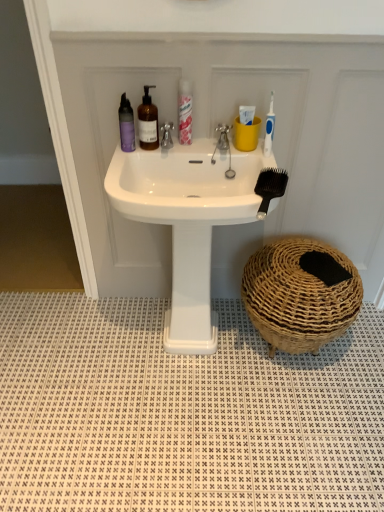
This screenshot has width=384, height=512. What are the coordinates of `vacant area situated to the left side of black plastic brush at center` in the screenshot? It's located at (217, 199).